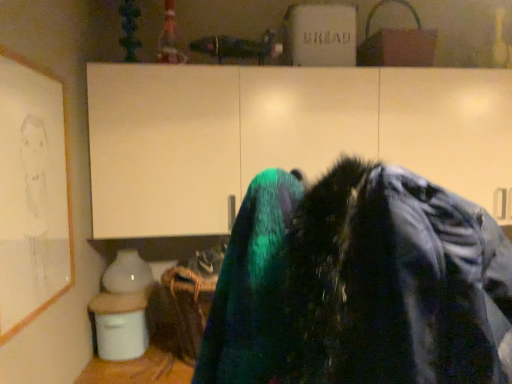
Describe the element at coordinates (359, 284) in the screenshot. This screenshot has width=512, height=384. I see `shiny green sweatshirt at center` at that location.

Where is `shiny green sweatshirt at center`? This screenshot has width=512, height=384. shiny green sweatshirt at center is located at coordinates (359, 284).

In the scene shown: In order to face shiny green sweatshirt at center, should I rotate leftwards or rightwards?

You should rotate right by 18.475 degrees.

The width and height of the screenshot is (512, 384). I want to click on shiny green sweatshirt at center, so click(359, 284).